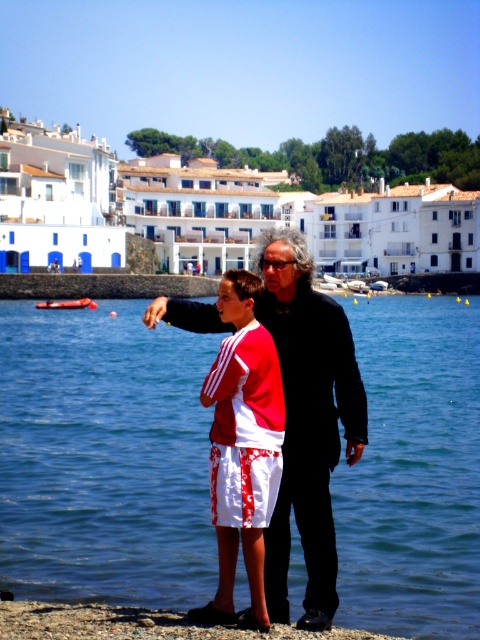
Question: Is blue water at center below black matte jacket at center?

Choices:
 (A) yes
 (B) no

Answer: (A)

Question: Which of the following is the closest to the observer?

Choices:
 (A) (312, 616)
 (B) (101, 474)

Answer: (A)

Question: Which object is farther from the camera taking this photo?

Choices:
 (A) blue water at center
 (B) white cotton shorts at center

Answer: (A)

Question: Does black matte jacket at center appear over white cotton shorts at center?

Choices:
 (A) yes
 (B) no

Answer: (A)

Question: Considering the real-world distances, which object is closest to the black matte jacket at center?

Choices:
 (A) blue water at center
 (B) white cotton shorts at center

Answer: (B)

Question: Does black matte jacket at center have a smaller size compared to white cotton shorts at center?

Choices:
 (A) no
 (B) yes

Answer: (A)